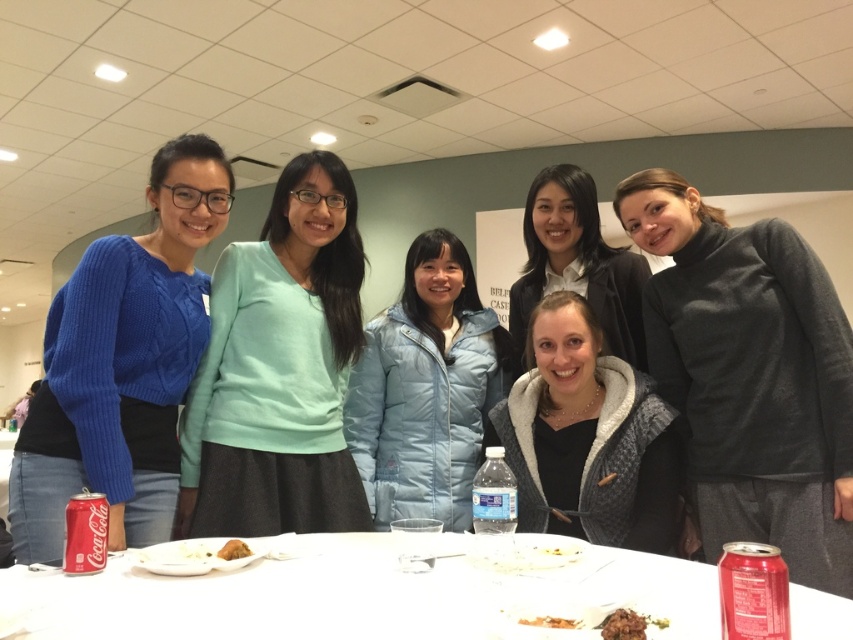
Does white plastic table at center have a lesser width compared to cable-knit sweater at left?

Incorrect, white plastic table at center's width is not less than cable-knit sweater at left's.

Identify the location of white plastic table at center. coord(355,596).

Is point (76, 467) farther from viewer compared to point (721, 632)?

That is True.

Is cable-knit sweater at left positioned at the back of metallic red can at lower right?

Yes, it is behind metallic red can at lower right.

Does point (218, 157) come in front of point (732, 560)?

No, it is behind (732, 560).

At what (x,y) coordinates should I click in order to perform the action: click on cable-knit sweater at left. Please return your answer as a coordinate pair (x, y). This screenshot has height=640, width=853. Looking at the image, I should click on (122, 364).

Is metallic red can at lower right wider than red matte coca-cola can at lower left?

Yes.

Is metallic red can at lower right thinner than red matte coca-cola can at lower left?

Incorrect, metallic red can at lower right's width is not less than red matte coca-cola can at lower left's.

Who is more distant from viewer, (741,634) or (90,541)?

The point (90,541) is behind.

Where is `metallic red can at lower right`? metallic red can at lower right is located at coordinates (752, 592).